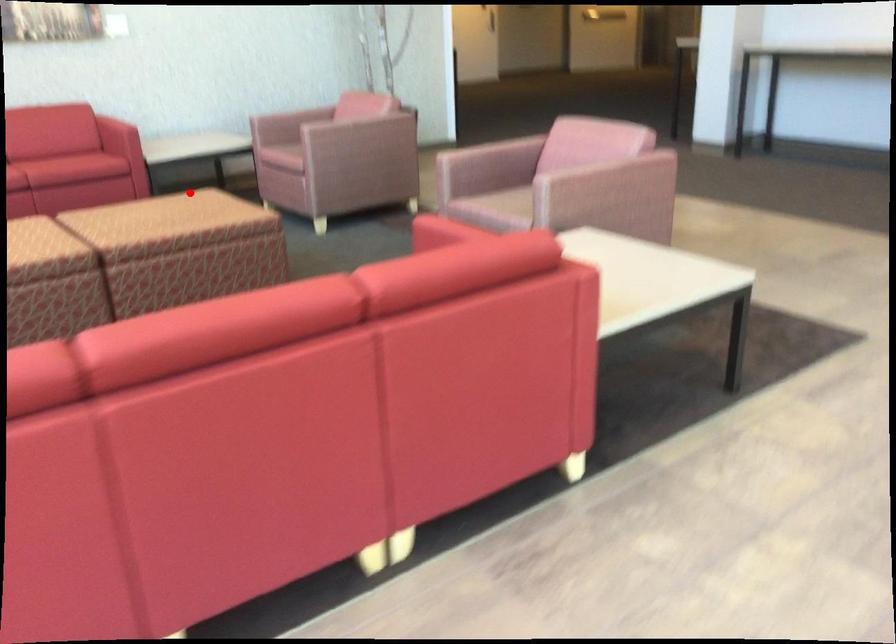
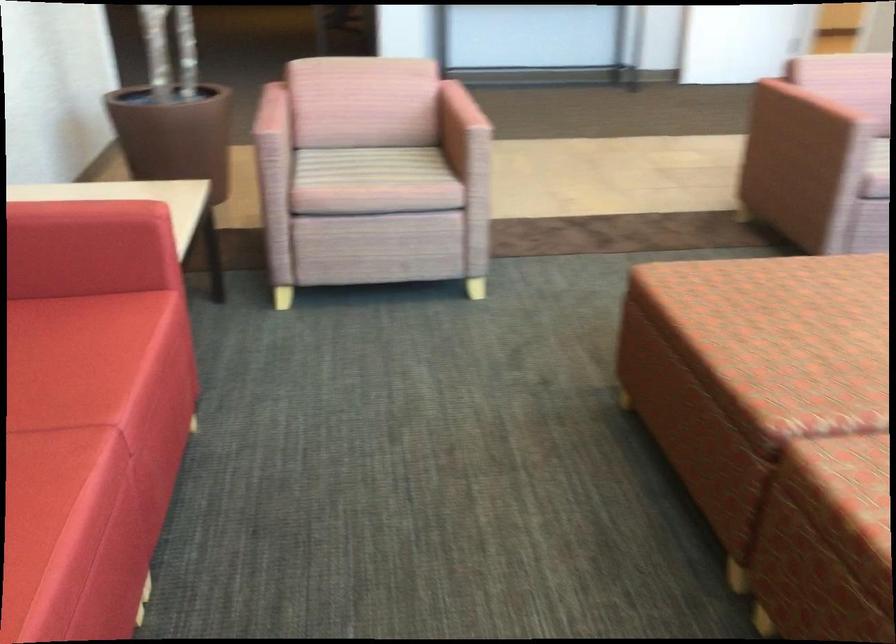
Question: I am providing you with two images of the same scene from different viewpoints. A red point is shown in image1. For the corresponding object point in image2, is it positioned nearer or farther from the camera?

Choices:
 (A) Nearer
 (B) Farther

Answer: (A)